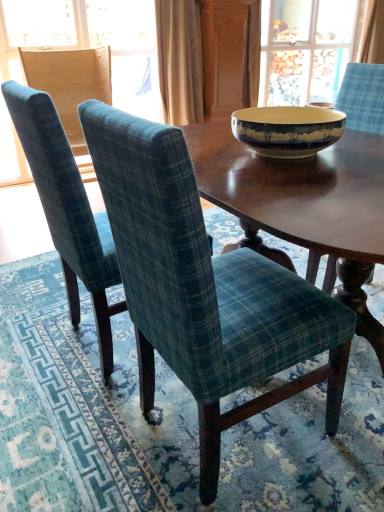
Question: From a real-world perspective, is matte ceramic bowl at center positioned above or below beige fabric curtain at upper center, the second curtain viewed from the back?

Choices:
 (A) above
 (B) below

Answer: (B)

Question: Considering the positions of point (261, 122) and point (187, 81), is point (261, 122) closer or farther from the camera than point (187, 81)?

Choices:
 (A) farther
 (B) closer

Answer: (B)

Question: Which is farther from the matte ceramic bowl at center?

Choices:
 (A) green plaid fabric chair at center, which appears as the first chair when viewed from the right
 (B) teal plaid chair at center, the 2th chair viewed from the left
 (C) beige fabric curtain at upper center, acting as the 1th curtain starting from the front
 (D) clear glass door at upper center
 (E) blue fabric chair at left

Answer: (D)

Question: Which of these objects is positioned closest to the teal plaid chair at left, the 3th chair when ordered from right to left?

Choices:
 (A) green plaid fabric chair at center, the third chair when ordered from left to right
 (B) beige fabric curtain at upper center, which is the second curtain in top-to-bottom order
 (C) blue plaid curtain at upper right, acting as the 1th curtain starting from the right
 (D) blue fabric chair at left
 (E) matte ceramic bowl at center

Answer: (D)